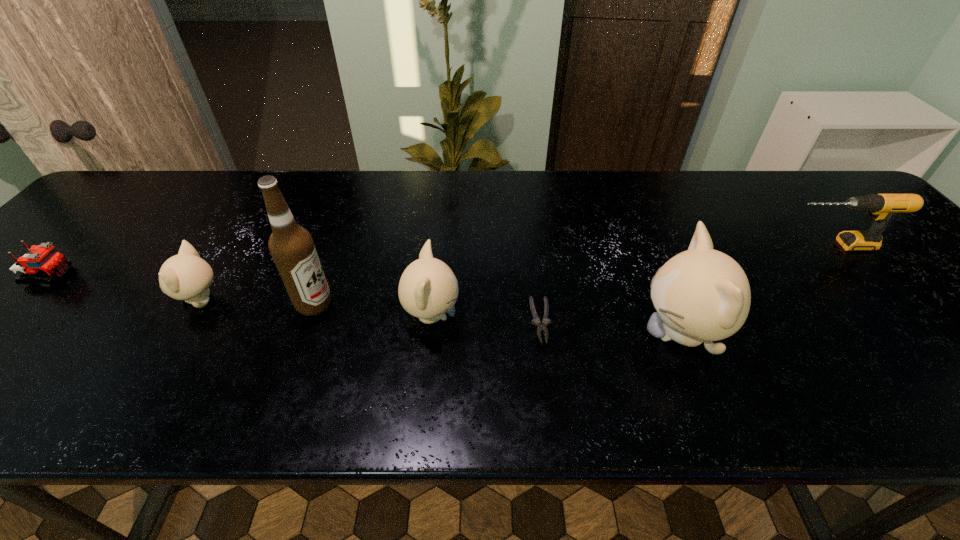
Where is `the shortest object`? Image resolution: width=960 pixels, height=540 pixels. the shortest object is located at coordinates (536, 321).

The width and height of the screenshot is (960, 540). In order to click on the third object from right to left in this screenshot , I will do `click(536, 321)`.

Where is `the fifth object from right to left`? This screenshot has height=540, width=960. the fifth object from right to left is located at coordinates (292, 248).

Find the location of a particular element. the tallest object is located at coordinates (292, 248).

Image resolution: width=960 pixels, height=540 pixels. I want to click on vacant space situated 0.140m on the face of the leftmost kitten, so click(x=116, y=299).

Find the location of a particular element. Image resolution: width=960 pixels, height=540 pixels. vacant space located on the face of the leftmost kitten is located at coordinates (67, 299).

You are a GUI agent. You are given a task and a screenshot of the screen. Output one action in this format:
    pyautogui.click(x=<x>, y=<y>)
    Task: Click on the blank space located on the face of the leftmost kitten
    The width and height of the screenshot is (960, 540).
    Given the screenshot: What is the action you would take?
    (x=81, y=299)

The height and width of the screenshot is (540, 960). In order to click on free space located on the face of the second kitten from right to left in this screenshot , I will do `click(621, 315)`.

Where is `vacant space located 0.100m on the face of the tallest kitten`? vacant space located 0.100m on the face of the tallest kitten is located at coordinates (591, 334).

Identify the location of vacant space located 0.170m on the face of the tallest kitten. The height and width of the screenshot is (540, 960). (558, 334).